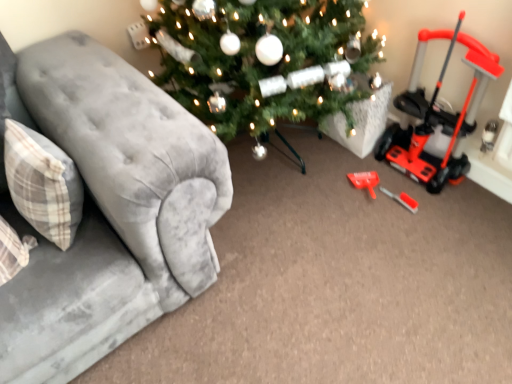
Question: Are orange plastic push mower at right and plaid fabric pillow at left beside each other?

Choices:
 (A) no
 (B) yes

Answer: (A)

Question: Could plaid fabric pillow at left be considered to be inside orange plastic push mower at right?

Choices:
 (A) no
 (B) yes

Answer: (A)

Question: Is there a large distance between orange plastic push mower at right and plaid fabric pillow at left?

Choices:
 (A) no
 (B) yes

Answer: (B)

Question: Could you tell me if orange plastic push mower at right is turned towards plaid fabric pillow at left?

Choices:
 (A) yes
 (B) no

Answer: (A)

Question: From a real-world perspective, is orange plastic push mower at right over plaid fabric pillow at left?

Choices:
 (A) no
 (B) yes

Answer: (A)

Question: Is orange plastic push mower at right further to camera compared to plaid fabric pillow at left?

Choices:
 (A) yes
 (B) no

Answer: (A)

Question: Is velvet gray couch at left in front of plaid fabric pillow at left?

Choices:
 (A) yes
 (B) no

Answer: (A)

Question: From a real-world perspective, is velvet gray couch at left positioned under plaid fabric pillow at left based on gravity?

Choices:
 (A) yes
 (B) no

Answer: (A)

Question: From a real-world perspective, does velvet gray couch at left stand above plaid fabric pillow at left?

Choices:
 (A) no
 (B) yes

Answer: (A)

Question: Is there a large distance between velvet gray couch at left and plaid fabric pillow at left?

Choices:
 (A) no
 (B) yes

Answer: (A)

Question: Can you confirm if velvet gray couch at left is bigger than plaid fabric pillow at left?

Choices:
 (A) yes
 (B) no

Answer: (A)

Question: Is velvet gray couch at left not within plaid fabric pillow at left?

Choices:
 (A) yes
 (B) no

Answer: (A)

Question: Is red plastic screwdriver at lower right facing towards velvet gray couch at left?

Choices:
 (A) no
 (B) yes

Answer: (A)